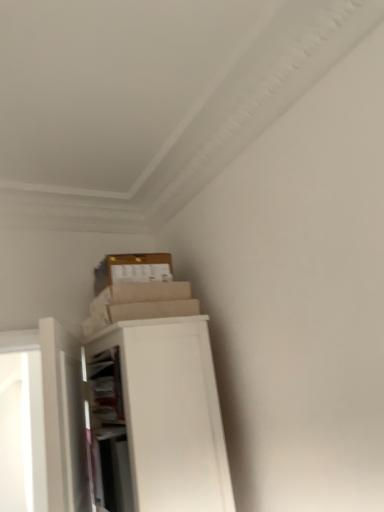
What is the approximate width of white matte door at left?

The width of white matte door at left is 3.72 inches.

This screenshot has width=384, height=512. Describe the element at coordinates (64, 419) in the screenshot. I see `white matte door at left` at that location.

The image size is (384, 512). In order to click on white matte door at left in this screenshot , I will do `click(64, 419)`.

Describe the element at coordinates (171, 414) in the screenshot. I see `white matte/file cabinet at upper left` at that location.

What are the coordinates of `white matte/file cabinet at upper left` in the screenshot? It's located at (171, 414).

Where is `white matte door at left`? This screenshot has height=512, width=384. white matte door at left is located at coordinates (64, 419).

Considering the positions of objects white matte/file cabinet at upper left and white matte door at left in the image provided, who is more to the left, white matte/file cabinet at upper left or white matte door at left?

From the viewer's perspective, white matte door at left appears more on the left side.

In the scene shown: Which object is closer to the camera taking this photo, white matte/file cabinet at upper left or white matte door at left?

white matte door at left is closer to the camera.

Considering the positions of point (159, 438) and point (71, 357), is point (159, 438) closer or farther from the camera than point (71, 357)?

Point (159, 438).

From the image's perspective, which is below, white matte/file cabinet at upper left or white matte door at left?

From the image's view, white matte/file cabinet at upper left is below.

From a real-world perspective, between white matte/file cabinet at upper left and white matte door at left, who is vertically lower?

white matte/file cabinet at upper left, from a real-world perspective.

Does white matte/file cabinet at upper left have a greater width compared to white matte door at left?

Correct, the width of white matte/file cabinet at upper left exceeds that of white matte door at left.

Which of these two, white matte/file cabinet at upper left or white matte door at left, stands shorter?

white matte door at left is shorter.

Between white matte/file cabinet at upper left and white matte door at left, which one has smaller size?

Smaller between the two is white matte door at left.

Is white matte door at left located within white matte/file cabinet at upper left?

No, white matte door at left is located outside of white matte/file cabinet at upper left.

Can you see white matte/file cabinet at upper left touching white matte door at left?

white matte/file cabinet at upper left and white matte door at left are not in contact.

Is white matte/file cabinet at upper left facing away from white matte door at left?

Yes, white matte/file cabinet at upper left is positioned with its back facing white matte door at left.

At what (x,y) coordinates should I click in order to perform the action: click on file cabinet below the white matte door at left (from the image's perspective). Please return your answer as a coordinate pair (x, y). Image resolution: width=384 pixels, height=512 pixels. Looking at the image, I should click on (171, 414).

Does white matte door at left appear on the left side of white matte/file cabinet at upper left?

Yes, white matte door at left is to the left of white matte/file cabinet at upper left.

Which object is more forward, white matte door at left or white matte/file cabinet at upper left?

white matte door at left is more forward.

Does point (57, 408) appear closer or farther from the camera than point (203, 358)?

Point (57, 408) is positioned closer to the camera compared to point (203, 358).

From the picture: From the image's perspective, relative to white matte/file cabinet at upper left, is white matte door at left above or below?

From the image's perspective, white matte door at left appears above white matte/file cabinet at upper left.

Based on the photo, from a real-world perspective, is white matte door at left positioned over white matte/file cabinet at upper left based on gravity?

Yes.

From the picture: Considering the relative sizes of white matte door at left and white matte/file cabinet at upper left in the image provided, is white matte door at left thinner than white matte/file cabinet at upper left?

Correct, the width of white matte door at left is less than that of white matte/file cabinet at upper left.

Which of these two, white matte door at left or white matte/file cabinet at upper left, stands shorter?

white matte door at left is shorter.

Is white matte door at left bigger or smaller than white matte/file cabinet at upper left?

white matte door at left is smaller than white matte/file cabinet at upper left.

From the picture: Is white matte door at left situated inside white matte/file cabinet at upper left or outside?

white matte door at left is not enclosed by white matte/file cabinet at upper left.

Is white matte door at left far from white matte/file cabinet at upper left?

No, white matte door at left is not far from white matte/file cabinet at upper left.

Is white matte door at left aimed at white matte/file cabinet at upper left?

Yes, white matte door at left is facing white matte/file cabinet at upper left.

Locate an element on the screen. Image resolution: width=384 pixels, height=512 pixels. file cabinet behind the white matte door at left is located at coordinates (171, 414).

Locate an element on the screen. The width and height of the screenshot is (384, 512). door lying on the left of white matte/file cabinet at upper left is located at coordinates (64, 419).

You are a GUI agent. You are given a task and a screenshot of the screen. Output one action in this format:
    pyautogui.click(x=<x>, y=<y>)
    Task: Click on the file cabinet lying below the white matte door at left (from the image's perspective)
    
    Given the screenshot: What is the action you would take?
    pyautogui.click(x=171, y=414)